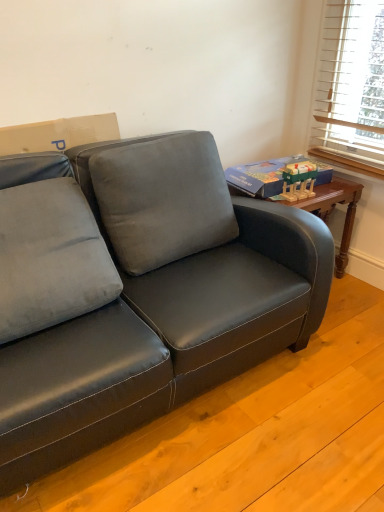
Locate an element on the screen. free space above satin black couch at lower left (from a real-world perspective) is located at coordinates (272, 407).